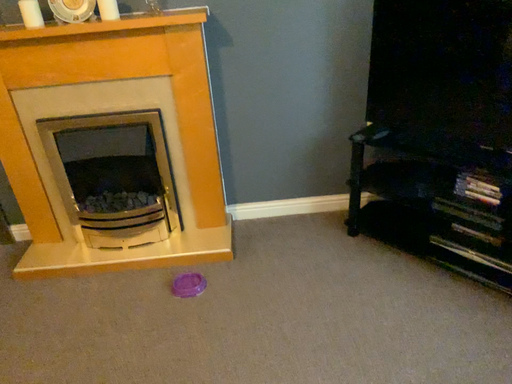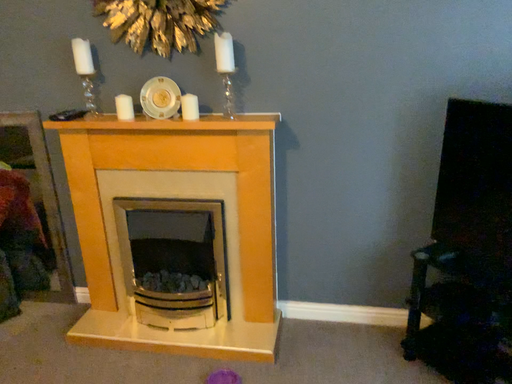
Question: How did the camera likely rotate when shooting the video?

Choices:
 (A) rotated left
 (B) rotated right

Answer: (A)